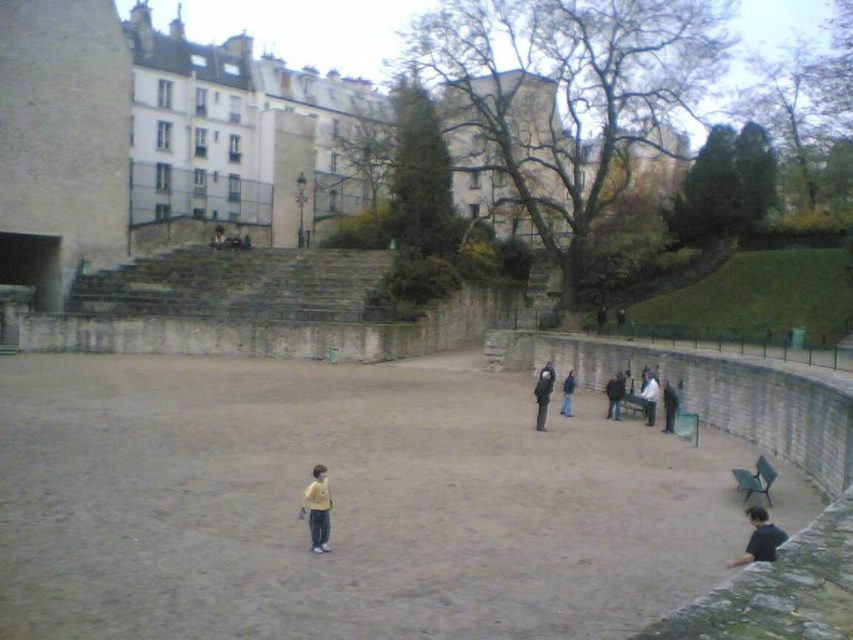
Can you confirm if yellow matte shirt at lower center is wider than dark gray fabric jacket at center right?

Incorrect, yellow matte shirt at lower center's width does not surpass dark gray fabric jacket at center right's.

Is point (328, 525) farther from camera compared to point (537, 419)?

No, it is not.

You are a GUI agent. You are given a task and a screenshot of the screen. Output one action in this format:
    pyautogui.click(x=<x>, y=<y>)
    Task: Click on the yellow matte shirt at lower center
    This screenshot has width=853, height=640.
    Given the screenshot: What is the action you would take?
    pyautogui.click(x=317, y=508)

Find the location of `yellow matte shirt at lower center`. yellow matte shirt at lower center is located at coordinates 317,508.

Is dark gray fabric jacket at center right thinner than dark blue jacket at center right?

Incorrect, dark gray fabric jacket at center right's width is not less than dark blue jacket at center right's.

The width and height of the screenshot is (853, 640). What do you see at coordinates (543, 394) in the screenshot?
I see `dark gray fabric jacket at center right` at bounding box center [543, 394].

Identify the location of dark gray fabric jacket at center right. This screenshot has height=640, width=853. (543, 394).

Find the location of `dark gray fabric jacket at center right`. dark gray fabric jacket at center right is located at coordinates (543, 394).

Who is higher up, dark gray fabric jacket at center right or dark blue jacket at center?

dark gray fabric jacket at center right is higher up.

The image size is (853, 640). Describe the element at coordinates (543, 394) in the screenshot. I see `dark gray fabric jacket at center right` at that location.

This screenshot has height=640, width=853. What are the coordinates of `dark gray fabric jacket at center right` in the screenshot? It's located at (543, 394).